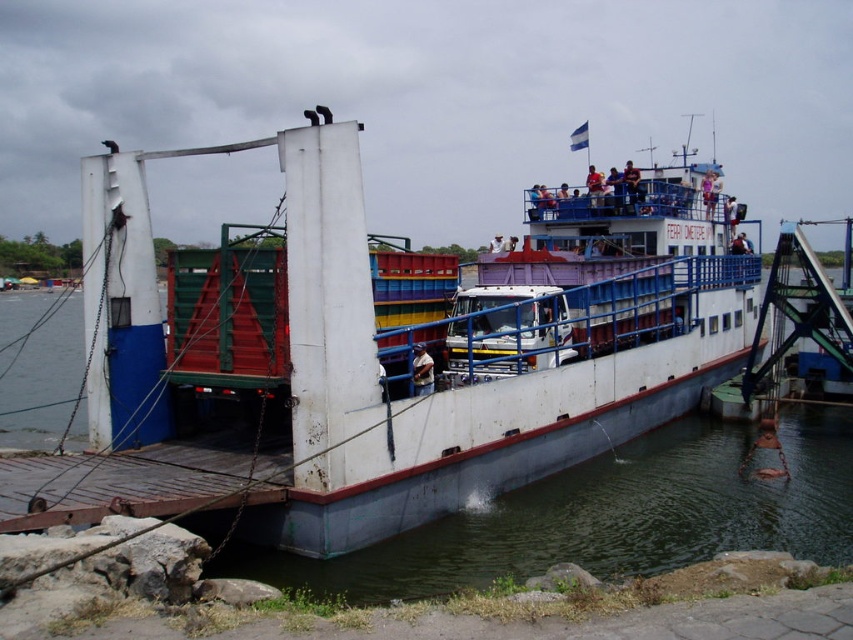
You are a photographer trying to capture the white matte boat at center and the light brown leather jacket at center in a single frame. Given that your camera has a fixed focal length, which object should you position closer to the center of the frame to ensure both are fully visible?

The white matte boat at center is wider than the light brown leather jacket at center, so positioning the boat closer to the center of the frame will allow both objects to fit within the camera view.

You are a passenger on the ferry and want to take a photo of the light blue fabric shirt at upper center without the white matte boat at center blocking the view. Is this possible?

The white matte boat at center is taller than the light blue fabric shirt at upper center, so the boat may block the view of the shirt unless you position yourself lower or move to a different angle where the boat is not in the foreground.